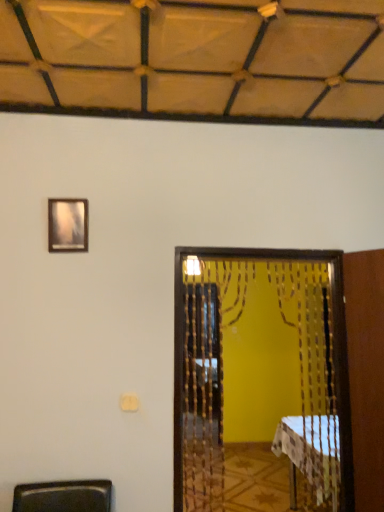
You are a GUI agent. You are given a task and a screenshot of the screen. Output one action in this format:
    pyautogui.click(x=<x>, y=<y>)
    Task: Click on the white checkered tablecloth at lower right
    
    Given the screenshot: What is the action you would take?
    pyautogui.click(x=311, y=453)

Describe the element at coordinates (261, 379) in the screenshot. I see `wooden beaded screen door at center` at that location.

In the scene shown: What is the approximate width of wooden beaded screen door at center?

1.93 inches.

Describe the element at coordinates (68, 225) in the screenshot. I see `wooden frame at upper left` at that location.

In order to face wooden frame at upper left, should I rotate leftwards or rightwards?

You should rotate left by 16.510 degrees.

The image size is (384, 512). I want to click on white checkered tablecloth at lower right, so click(311, 453).

Does point (71, 242) lie behind point (242, 420)?

No, it is not.

Considering the relative positions of wooden frame at upper left and wooden beaded screen door at center in the image provided, is wooden frame at upper left to the left or to the right of wooden beaded screen door at center?

Clearly, wooden frame at upper left is on the left of wooden beaded screen door at center in the image.

Can you tell me how much wooden frame at upper left and wooden beaded screen door at center differ in facing direction?

0.1 degrees separate the facing orientations of wooden frame at upper left and wooden beaded screen door at center.

Who is shorter, wooden frame at upper left or wooden beaded screen door at center?

With less height is wooden frame at upper left.

How different are the orientations of wooden beaded screen door at center and wooden frame at upper left in degrees?

0.1 degrees separate the facing orientations of wooden beaded screen door at center and wooden frame at upper left.

Considering the relative positions of wooden beaded screen door at center and wooden frame at upper left in the image provided, is wooden beaded screen door at center in front of wooden frame at upper left?

Yes.

You are a GUI agent. You are given a task and a screenshot of the screen. Output one action in this format:
    pyautogui.click(x=<x>, y=<y>)
    Task: Click on the screen door below the wooden frame at upper left (from a real-world perspective)
    The height and width of the screenshot is (512, 384).
    Given the screenshot: What is the action you would take?
    pyautogui.click(x=261, y=379)

Is wooden beaded screen door at center to the left or to the right of wooden frame at upper left in the image?

Clearly, wooden beaded screen door at center is on the right of wooden frame at upper left in the image.

Does white checkered tablecloth at lower right lie behind wooden frame at upper left?

Yes, white checkered tablecloth at lower right is further from the camera.

Considering the relative sizes of white checkered tablecloth at lower right and wooden frame at upper left in the image provided, is white checkered tablecloth at lower right bigger than wooden frame at upper left?

Yes, white checkered tablecloth at lower right is bigger than wooden frame at upper left.

Is point (303, 422) more distant than point (66, 204)?

Yes, it is.

Locate an element on the screen. table that appears below the wooden frame at upper left (from the image's perspective) is located at coordinates (311, 453).

Relative to white checkered tablecloth at lower right, is wooden frame at upper left in front or behind?

Visually, wooden frame at upper left is located in front of white checkered tablecloth at lower right.

Is wooden frame at upper left shorter than white checkered tablecloth at lower right?

Indeed, wooden frame at upper left has a lesser height compared to white checkered tablecloth at lower right.

Consider the image. From the image's perspective, is wooden frame at upper left above white checkered tablecloth at lower right?

Yes, from the image's perspective, wooden frame at upper left is over white checkered tablecloth at lower right.

Considering the relative positions of wooden frame at upper left and white checkered tablecloth at lower right in the image provided, is wooden frame at upper left to the left of white checkered tablecloth at lower right from the viewer's perspective?

Correct, you'll find wooden frame at upper left to the left of white checkered tablecloth at lower right.

Considering the relative positions of wooden beaded screen door at center and white checkered tablecloth at lower right in the image provided, is wooden beaded screen door at center behind white checkered tablecloth at lower right?

No, it is in front of white checkered tablecloth at lower right.

Is wooden beaded screen door at center wider or thinner than white checkered tablecloth at lower right?

Considering their sizes, wooden beaded screen door at center looks slimmer than white checkered tablecloth at lower right.

Considering the points (263, 362) and (276, 450), which point is in front, point (263, 362) or point (276, 450)?

The point (263, 362) is more forward.

The width and height of the screenshot is (384, 512). Identify the location of screen door on the left side of white checkered tablecloth at lower right. (261, 379).

Based on the photo, are white checkered tablecloth at lower right and wooden beaded screen door at center making contact?

No, white checkered tablecloth at lower right is not touching wooden beaded screen door at center.

From a real-world perspective, is white checkered tablecloth at lower right located higher than wooden beaded screen door at center?

Actually, white checkered tablecloth at lower right is physically below wooden beaded screen door at center in the real world.

From the image's perspective, is white checkered tablecloth at lower right located beneath wooden beaded screen door at center?

Yes, from the image's perspective, white checkered tablecloth at lower right is below wooden beaded screen door at center.

Image resolution: width=384 pixels, height=512 pixels. In order to click on picture frame on the left of wooden beaded screen door at center in this screenshot , I will do `click(68, 225)`.

This screenshot has height=512, width=384. Find the location of `screen door below the wooden frame at upper left (from a real-world perspective)`. screen door below the wooden frame at upper left (from a real-world perspective) is located at coordinates (261, 379).

Estimate the real-world distances between objects in this image. Which object is further from white checkered tablecloth at lower right, wooden beaded screen door at center or wooden frame at upper left?

wooden frame at upper left.

Looking at the image, which one is located closer to wooden frame at upper left, wooden beaded screen door at center or white checkered tablecloth at lower right?

wooden beaded screen door at center.

Considering their positions, is white checkered tablecloth at lower right positioned closer to wooden beaded screen door at center than wooden frame at upper left?

The object closer to wooden beaded screen door at center is white checkered tablecloth at lower right.

From the image, which object appears to be nearer to wooden beaded screen door at center, wooden frame at upper left or white checkered tablecloth at lower right?

white checkered tablecloth at lower right lies closer to wooden beaded screen door at center than the other object.

Based on their spatial positions, is wooden frame at upper left or wooden beaded screen door at center further from white checkered tablecloth at lower right?

wooden frame at upper left is further to white checkered tablecloth at lower right.

When comparing their distances from wooden frame at upper left, does white checkered tablecloth at lower right or wooden beaded screen door at center seem further?

white checkered tablecloth at lower right is positioned further to the anchor wooden frame at upper left.

Locate an element on the screen. This screenshot has height=512, width=384. screen door between wooden frame at upper left and white checkered tablecloth at lower right vertically is located at coordinates (261, 379).